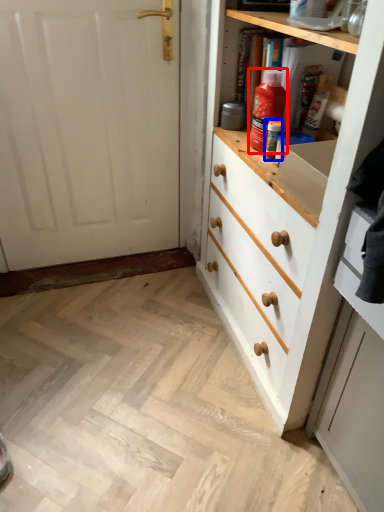
Question: Among these objects, which one is nearest to the camera, cleaning product (highlighted by a red box) or bottle (highlighted by a blue box)?

Choices:
 (A) cleaning product
 (B) bottle

Answer: (A)